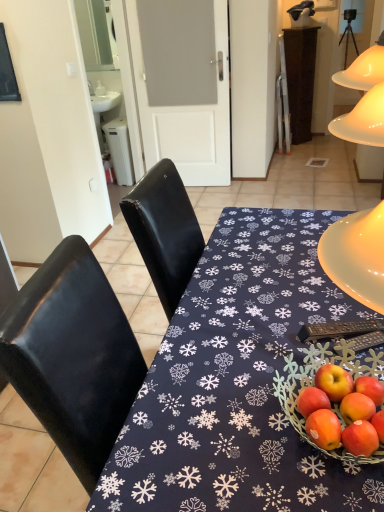
Question: Should I look upward or downward to see black plastic remote control at lower right?

Choices:
 (A) down
 (B) up

Answer: (A)

Question: Considering the relative positions of black plastic remote control at lower right and matte black table at center in the image provided, is black plastic remote control at lower right to the right of matte black table at center from the viewer's perspective?

Choices:
 (A) yes
 (B) no

Answer: (A)

Question: From a real-world perspective, does black plastic remote control at lower right sit lower than matte black table at center?

Choices:
 (A) no
 (B) yes

Answer: (A)

Question: Could you tell me if black plastic remote control at lower right is facing matte black table at center?

Choices:
 (A) yes
 (B) no

Answer: (A)

Question: Is black plastic remote control at lower right oriented away from matte black table at center?

Choices:
 (A) no
 (B) yes

Answer: (B)

Question: Is black plastic remote control at lower right outside matte black table at center?

Choices:
 (A) no
 (B) yes

Answer: (A)

Question: From the image's perspective, is black plastic remote control at lower right below matte black table at center?

Choices:
 (A) no
 (B) yes

Answer: (A)

Question: Can we say matte black table at center lies outside black plastic remote control at lower right?

Choices:
 (A) no
 (B) yes

Answer: (B)

Question: From a real-world perspective, is matte black table at center located higher than black plastic remote control at lower right?

Choices:
 (A) yes
 (B) no

Answer: (B)

Question: From a real-world perspective, does matte black table at center sit lower than black plastic remote control at lower right?

Choices:
 (A) no
 (B) yes

Answer: (B)

Question: Is matte black table at center positioned in front of black plastic remote control at lower right?

Choices:
 (A) no
 (B) yes

Answer: (B)

Question: Is matte black table at center aimed at black plastic remote control at lower right?

Choices:
 (A) yes
 (B) no

Answer: (B)

Question: Does matte black table at center appear on the right side of black plastic remote control at lower right?

Choices:
 (A) yes
 (B) no

Answer: (B)

Question: Is black plastic remote control at lower right taller or shorter than matte black table at center?

Choices:
 (A) tall
 (B) short

Answer: (B)